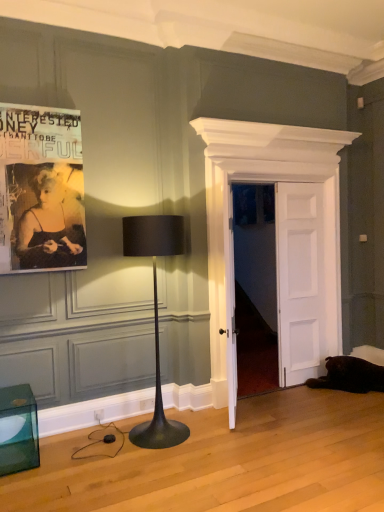
What are the coordinates of `vacant space in front of white wooden door at center, the first door when ordered from left to right` in the screenshot? It's located at (308, 426).